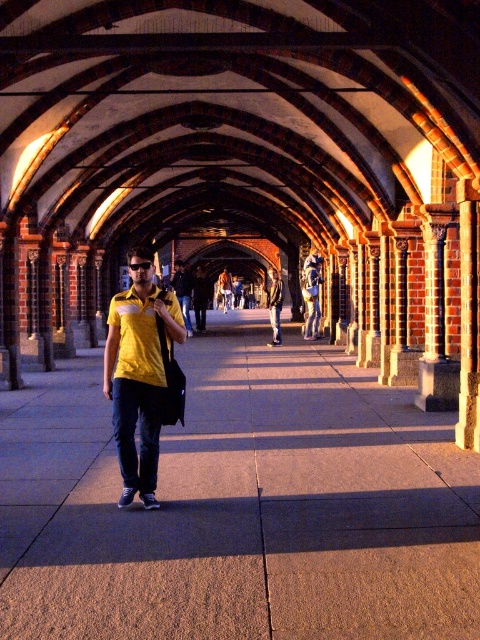
Question: Among these points, which one is farthest from the camera?

Choices:
 (A) (276, 280)
 (B) (36, 493)
 (C) (146, 362)

Answer: (A)

Question: Where is concrete pavement at center located in relation to denim pants at center in the image?

Choices:
 (A) left
 (B) right

Answer: (A)

Question: Among these objects, which one is nearest to the camera?

Choices:
 (A) concrete pavement at center
 (B) denim pants at center

Answer: (A)

Question: Does concrete pavement at center have a greater width compared to matte yellow shirt at center?

Choices:
 (A) no
 (B) yes

Answer: (B)

Question: Is matte yellow shirt at center wider than denim pants at center?

Choices:
 (A) no
 (B) yes

Answer: (A)

Question: Which of the following is the closest to the observer?

Choices:
 (A) matte yellow shirt at center
 (B) concrete pavement at center
 (C) denim pants at center

Answer: (B)